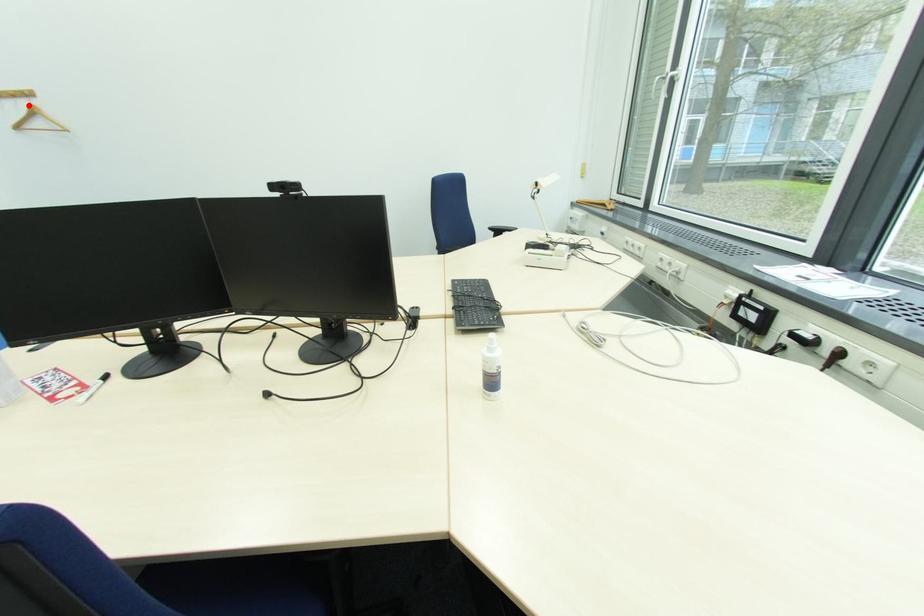
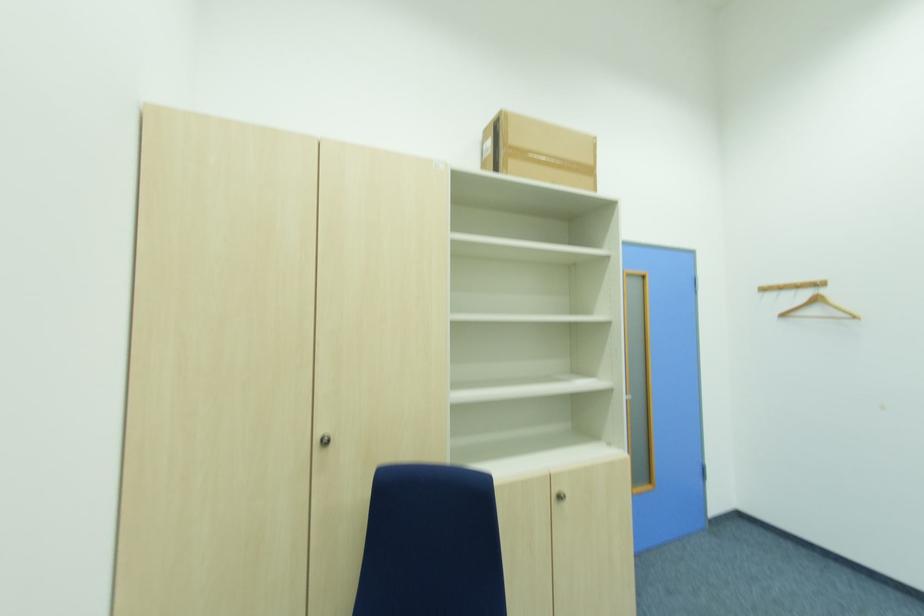
Question: I am providing you with two images of the same scene from different viewpoints. Image1 has a red point marked. In image2, the corresponding 3D location appears at what relative position? Reply with the corresponding letter.

Choices:
 (A) Closer
 (B) Farther

Answer: (A)